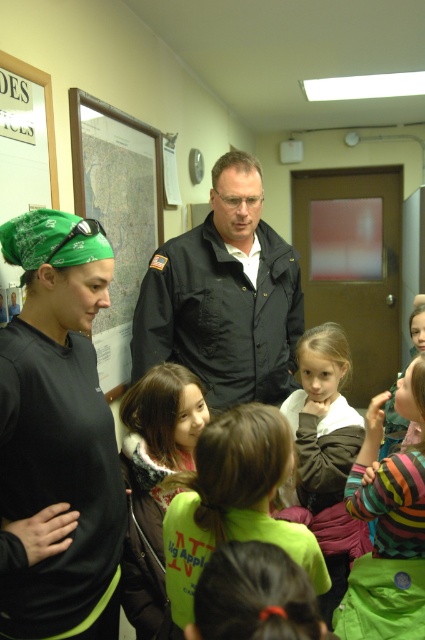
You are a photographer trying to capture a group photo of the green bandana at left and the dark gray uniform at center. Based on their heights, which object should you position closer to the camera to ensure both are in focus?

The green bandana at left is much taller than the dark gray uniform at center. To ensure both are in focus, position the shorter dark gray uniform at center closer to the camera.

You are a photographer trying to capture a group photo of the green fleece jacket at center and the brown fuzzy sweater at center. The camera is positioned at eye level. Which object should you focus on first to ensure both are in focus, considering their positions?

The green fleece jacket at center is below the brown fuzzy sweater at center, so you should focus on the brown fuzzy sweater at center first to ensure both are in focus since it is closer to the camera.

You are a photographer trying to capture a clear shot of the dark gray uniform at center without the green bandana at left blocking it. What should you do?

Move the camera to the right so that the dark gray uniform at center is no longer behind the green bandana at left, which is currently in front of it.